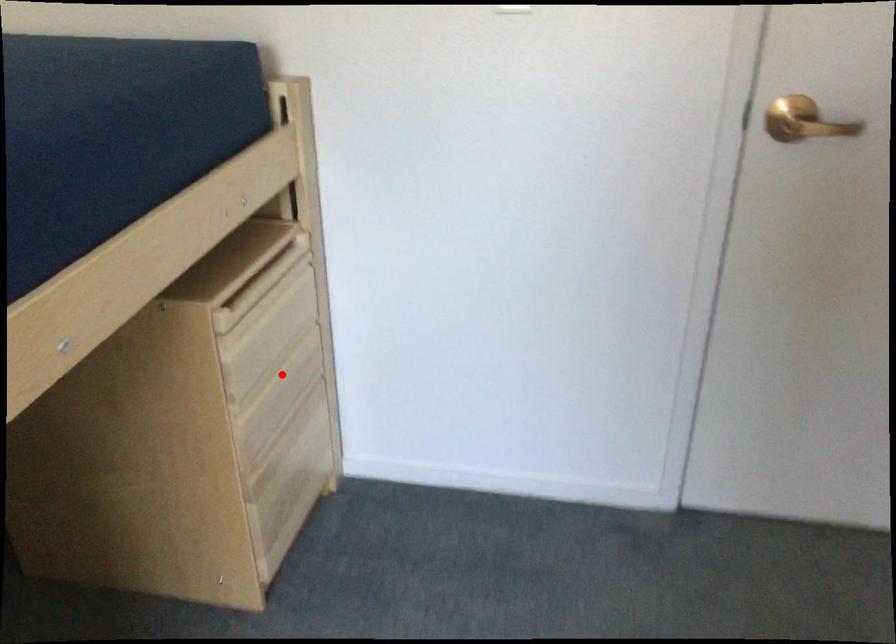
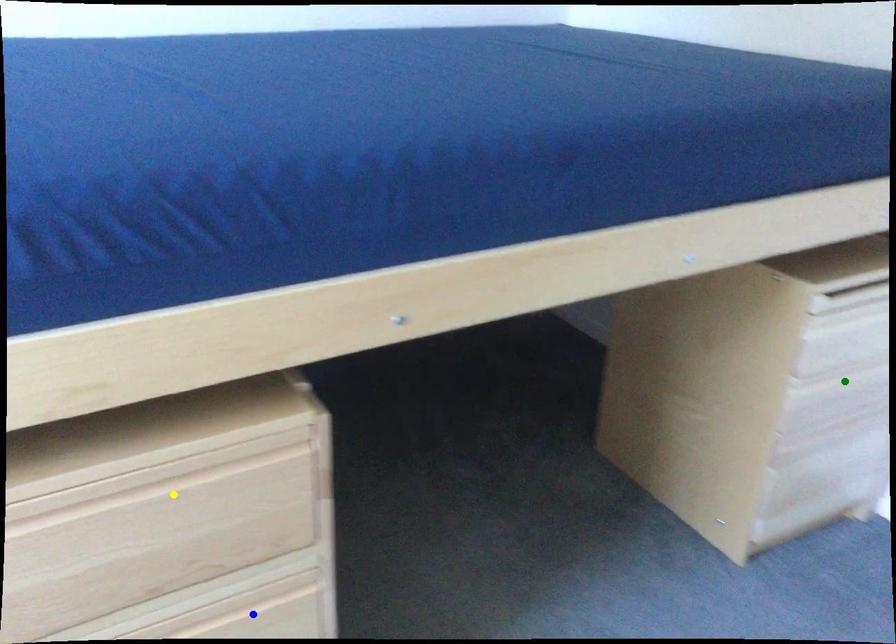
Question: I am providing you with two images of the same scene from different viewpoints. A red point is marked on the first image. You are given multiple points on the second image. Which spot in image 2 lines up with the point in image 1?

Choices:
 (A) green point
 (B) yellow point
 (C) blue point

Answer: (A)